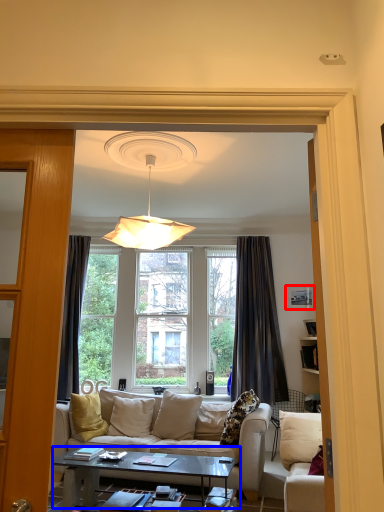
Question: Which point is closer to the camera, picture frame (highlighted by a red box) or coffee table (highlighted by a blue box)?

Choices:
 (A) picture frame
 (B) coffee table

Answer: (B)